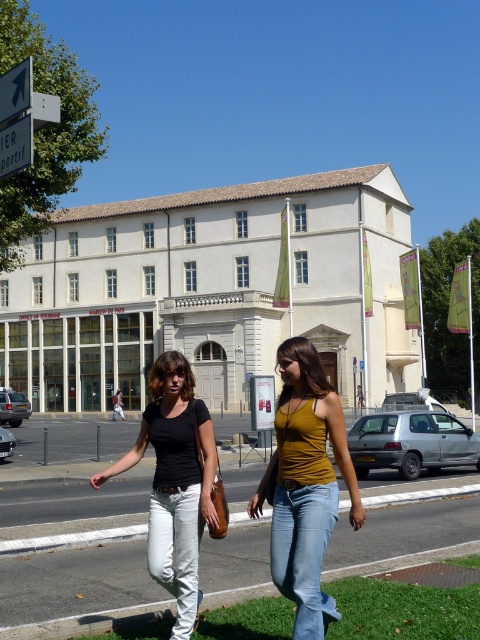
You are a photographer standing in front of the classical building. You notice the mustard yellow tank top at center and the white plastic arrow at upper left in your viewfinder. Which object appears larger in your camera frame?

The mustard yellow tank top at center appears larger in the camera frame because it is much taller than the white plastic arrow at upper left.

You are a photographer trying to capture both the white denim jeans at lower center and the white plastic arrow at upper left in the same frame. Which object should you focus on first to ensure both are in the shot?

The white denim jeans at lower center is larger in size than the white plastic arrow at upper left, so you should focus on the white denim jeans at lower center first to ensure both fit within the frame.

You are standing at point (x=31, y=131) and want to walk to the large white classical building in the scene. Which direction should you move relative to point (x=177, y=429) to reach the building?

You should move towards point (x=177, y=429) because it is in front of point (x=31, y=131), meaning the building is in that direction.